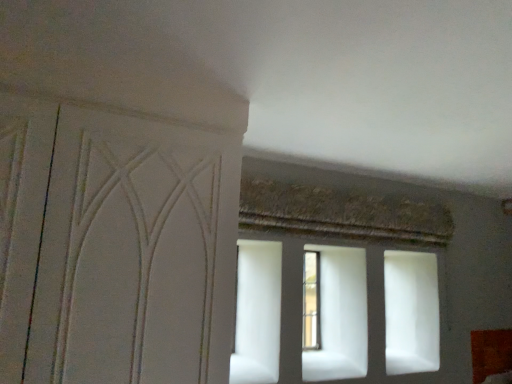
Question: In terms of width, does white matte screen door at left look wider or thinner when compared to clear glass window at center?

Choices:
 (A) thin
 (B) wide

Answer: (B)

Question: Is point (115, 218) closer or farther from the camera than point (316, 339)?

Choices:
 (A) farther
 (B) closer

Answer: (B)

Question: Considering the relative positions of white matte screen door at left and clear glass window at center in the image provided, is white matte screen door at left to the left or to the right of clear glass window at center?

Choices:
 (A) left
 (B) right

Answer: (A)

Question: From a real-world perspective, is clear glass window at center positioned above or below white matte screen door at left?

Choices:
 (A) below
 (B) above

Answer: (A)

Question: Which is correct: clear glass window at center is inside white matte screen door at left, or outside of it?

Choices:
 (A) outside
 (B) inside

Answer: (A)

Question: From the image's perspective, is clear glass window at center located above or below white matte screen door at left?

Choices:
 (A) below
 (B) above

Answer: (A)

Question: From their relative heights in the image, would you say clear glass window at center is taller or shorter than white matte screen door at left?

Choices:
 (A) tall
 (B) short

Answer: (B)